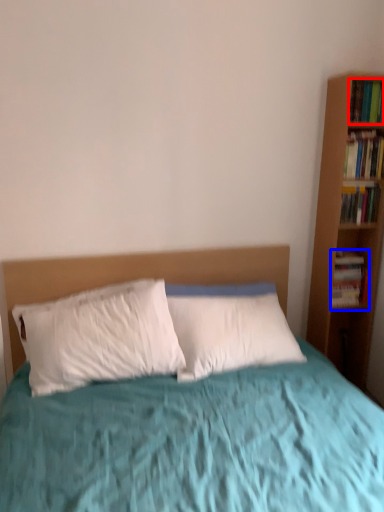
Question: Which of the following is the closest to the observer, book (highlighted by a red box) or book (highlighted by a blue box)?

Choices:
 (A) book
 (B) book

Answer: (A)